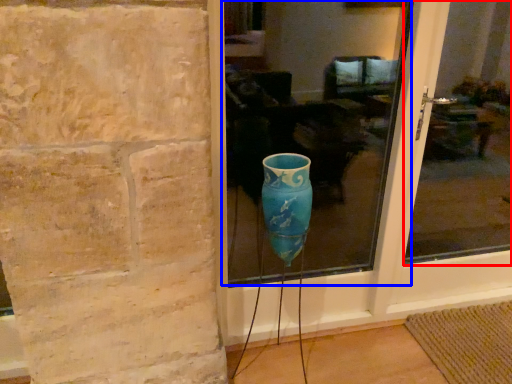
Question: Among these objects, which one is nearest to the camera, glass window (highlighted by a red box) or glass window (highlighted by a blue box)?

Choices:
 (A) glass window
 (B) glass window

Answer: (B)